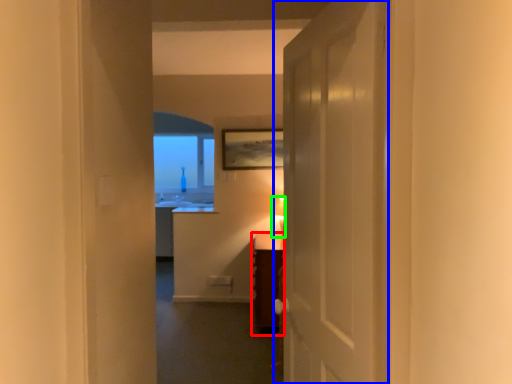
Question: Considering the real-world distances, which object is farthest from vanity (highlighted by a red box)? door (highlighted by a blue box) or table lamp (highlighted by a green box)?

Choices:
 (A) door
 (B) table lamp

Answer: (A)